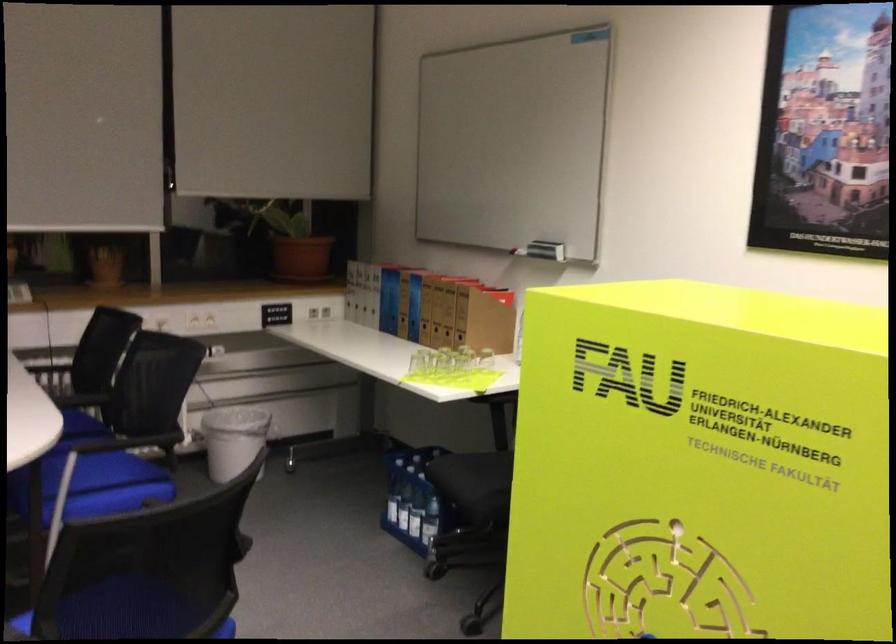
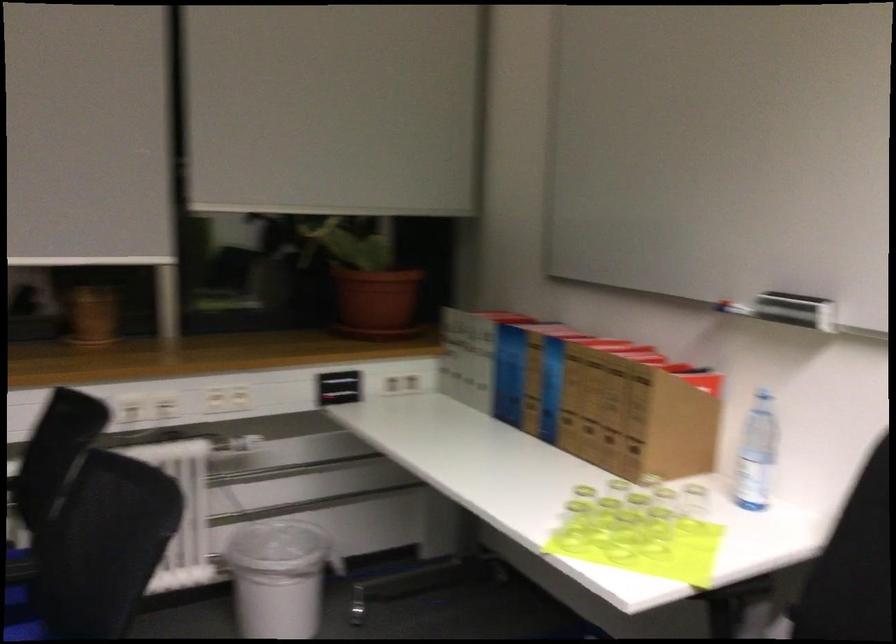
Where in the second image is the point corresponding to point (495, 359) from the first image?

(694, 498)